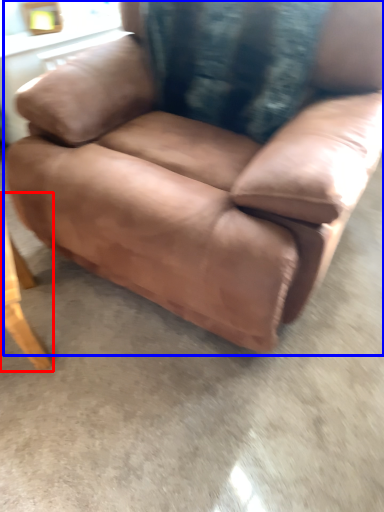
Question: Which object is closer to the camera taking this photo, table (highlighted by a red box) or chair (highlighted by a blue box)?

Choices:
 (A) table
 (B) chair

Answer: (B)